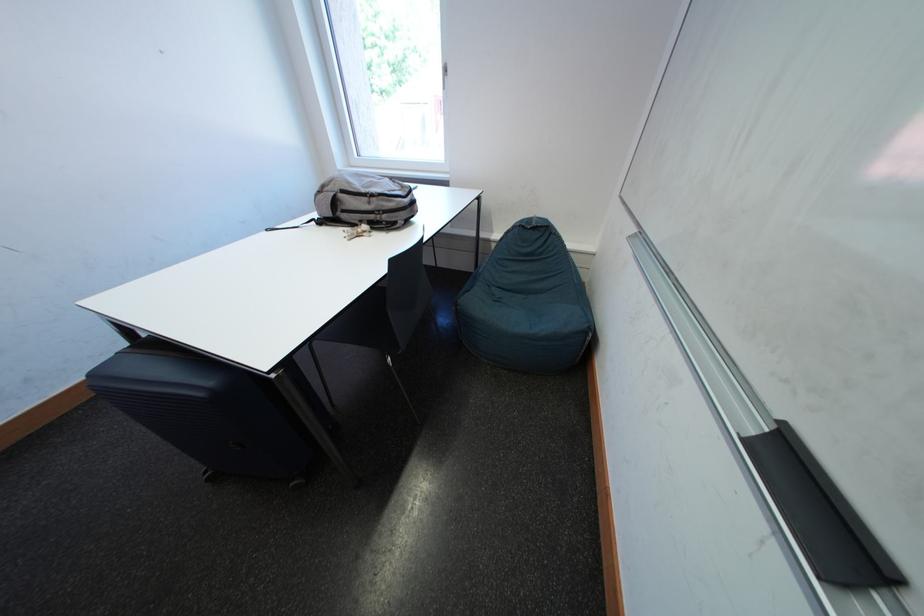
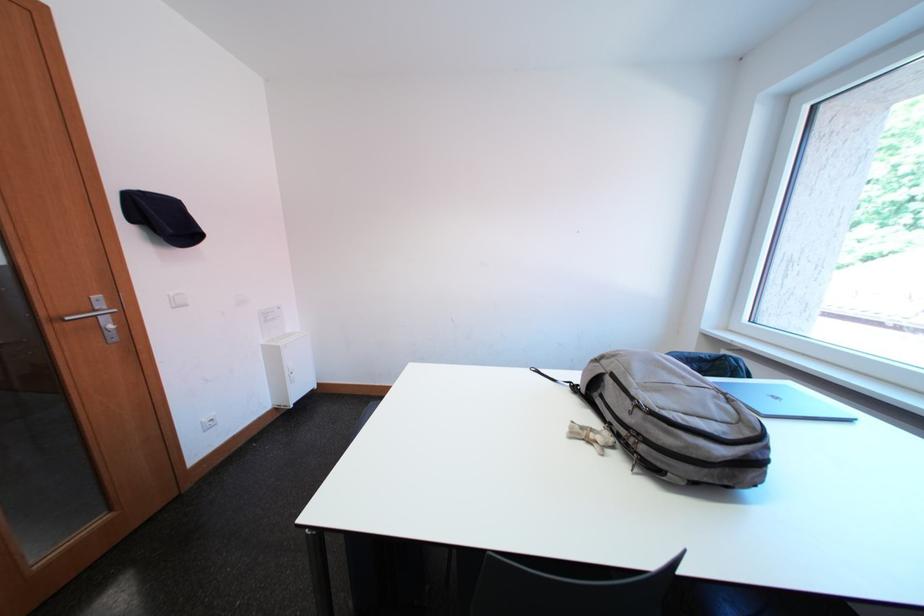
Question: Based on the continuous images, in which direction is the camera rotating? Reply with the corresponding letter.

Choices:
 (A) Left
 (B) Right
 (C) Up
 (D) Down

Answer: (A)